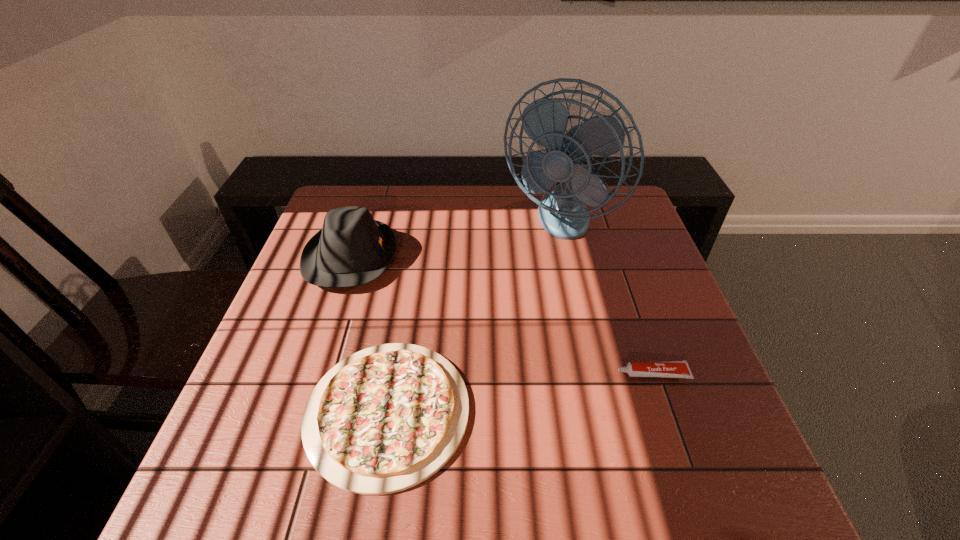
Where is `fan situated at the far edge`? Image resolution: width=960 pixels, height=540 pixels. fan situated at the far edge is located at coordinates (562, 212).

Find the location of a particular element. This screenshot has width=960, height=540. fedora located in the far edge section of the desktop is located at coordinates (352, 249).

Locate an element on the screen. The width and height of the screenshot is (960, 540). object at the near edge is located at coordinates (385, 419).

This screenshot has height=540, width=960. Identify the location of fedora that is at the left edge. (352, 249).

In order to click on pizza located in the left edge section of the desktop in this screenshot , I will do `click(385, 419)`.

This screenshot has width=960, height=540. I want to click on fan that is at the right edge, so click(562, 212).

Locate an element on the screen. Image resolution: width=960 pixels, height=540 pixels. toothpaste at the right edge is located at coordinates (669, 369).

Where is `object located in the far left corner section of the desktop`? This screenshot has width=960, height=540. object located in the far left corner section of the desktop is located at coordinates (352, 249).

The height and width of the screenshot is (540, 960). I want to click on object that is at the near left corner, so click(385, 419).

Identify the location of object located in the far right corner section of the desktop. Image resolution: width=960 pixels, height=540 pixels. (562, 212).